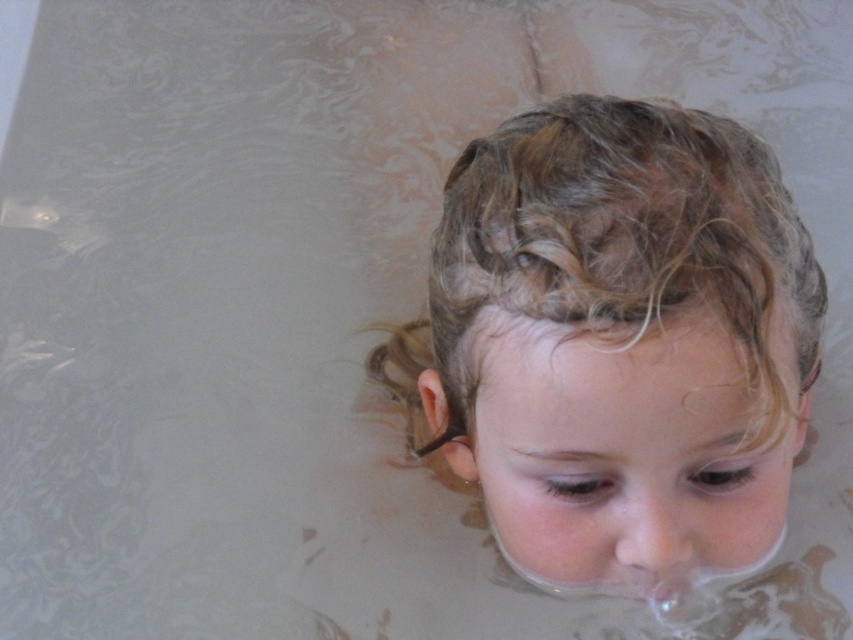
Question: Can you confirm if curly blonde hair at center is thinner than smooth skin nose at center?

Choices:
 (A) no
 (B) yes

Answer: (A)

Question: Is curly blonde hair at center to the right of smooth skin nose at center from the viewer's perspective?

Choices:
 (A) yes
 (B) no

Answer: (B)

Question: Which object appears farthest from the camera in this image?

Choices:
 (A) curly blonde hair at center
 (B) smooth skin nose at center

Answer: (B)

Question: Which point is closer to the camera taking this photo?

Choices:
 (A) (666, 518)
 (B) (720, 301)

Answer: (B)

Question: Does curly blonde hair at center come behind smooth skin nose at center?

Choices:
 (A) yes
 (B) no

Answer: (B)